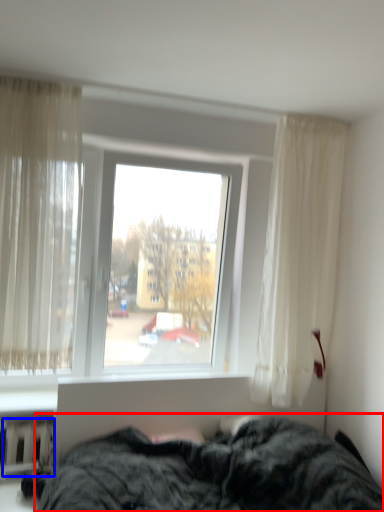
Question: Which point is closer to the camera, bed (highlighted by a red box) or radiator (highlighted by a blue box)?

Choices:
 (A) bed
 (B) radiator

Answer: (A)